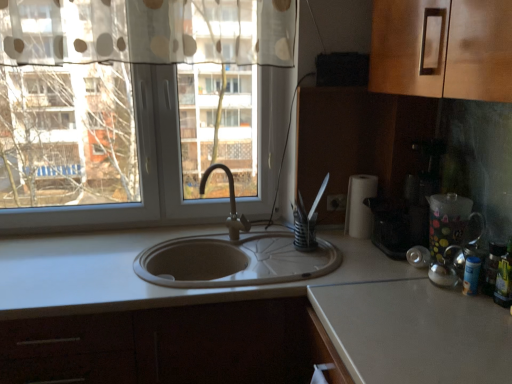
Question: Is green glass bottle at right at the back of matte silver faucet at center?

Choices:
 (A) no
 (B) yes

Answer: (A)

Question: Could you tell me if matte silver faucet at center is facing green glass bottle at right?

Choices:
 (A) no
 (B) yes

Answer: (A)

Question: Can you confirm if matte silver faucet at center is wider than green glass bottle at right?

Choices:
 (A) no
 (B) yes

Answer: (B)

Question: From a real-world perspective, is matte silver faucet at center under green glass bottle at right?

Choices:
 (A) no
 (B) yes

Answer: (A)

Question: Does matte silver faucet at center have a larger size compared to green glass bottle at right?

Choices:
 (A) no
 (B) yes

Answer: (B)

Question: Based on their sizes in the image, would you say green glass bottle at right is bigger or smaller than transparent plastic pitcher at right?

Choices:
 (A) small
 (B) big

Answer: (A)

Question: Is green glass bottle at right inside the boundaries of transparent plastic pitcher at right, or outside?

Choices:
 (A) inside
 (B) outside

Answer: (B)

Question: Is green glass bottle at right taller or shorter than transparent plastic pitcher at right?

Choices:
 (A) tall
 (B) short

Answer: (B)

Question: Is green glass bottle at right to the left or to the right of transparent plastic pitcher at right in the image?

Choices:
 (A) left
 (B) right

Answer: (B)

Question: Is white matte countertop at center situated inside black plastic coffee machine at right or outside?

Choices:
 (A) outside
 (B) inside

Answer: (A)

Question: In the image, is white matte countertop at center positioned in front of or behind black plastic coffee machine at right?

Choices:
 (A) front
 (B) behind

Answer: (A)

Question: Is point (338, 319) closer or farther from the camera than point (428, 240)?

Choices:
 (A) closer
 (B) farther

Answer: (A)

Question: Visually, is white matte countertop at center positioned to the left or to the right of black plastic coffee machine at right?

Choices:
 (A) left
 (B) right

Answer: (A)

Question: Is point (462, 228) closer or farther from the camera than point (2, 299)?

Choices:
 (A) closer
 (B) farther

Answer: (B)

Question: From the image's perspective, is transparent plastic pitcher at right located above or below white matte countertop at center?

Choices:
 (A) above
 (B) below

Answer: (A)